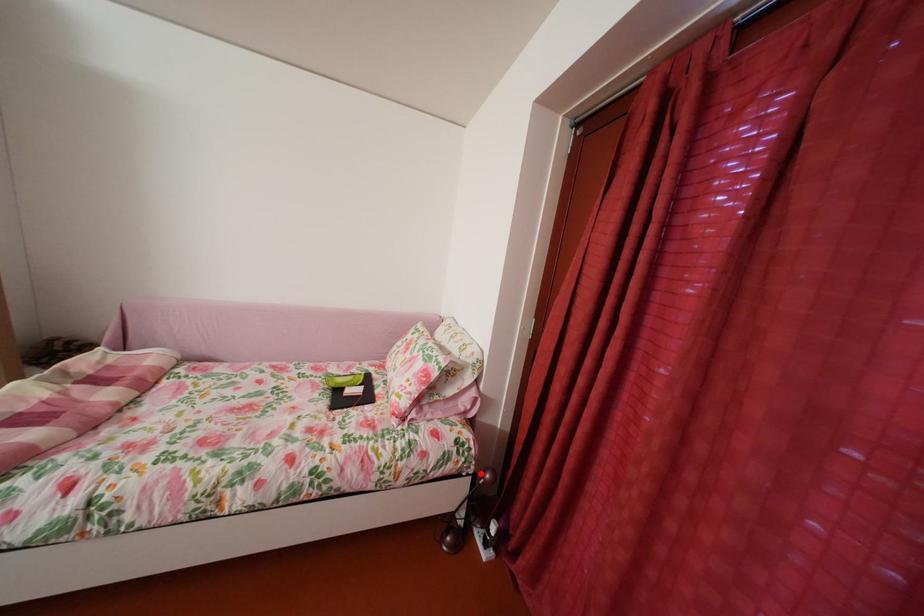
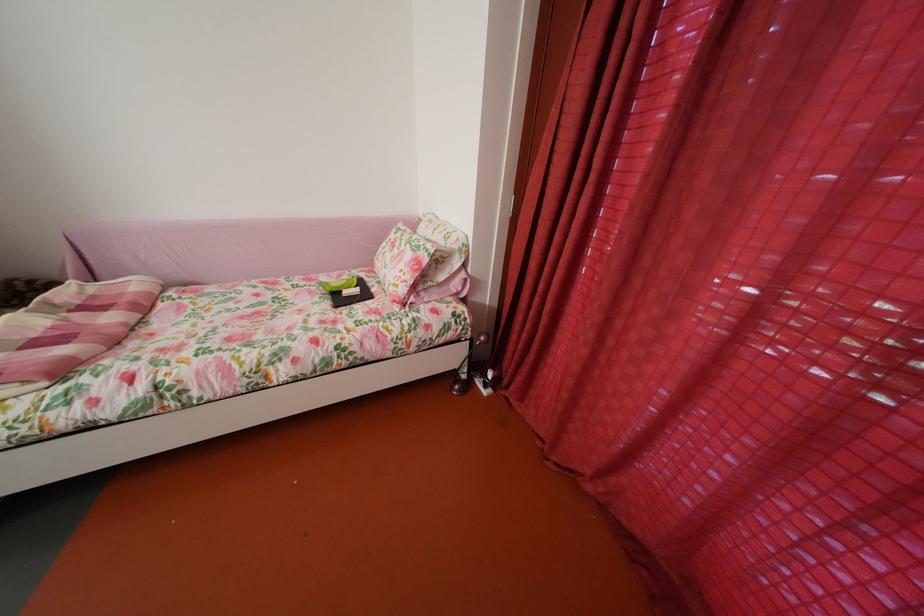
Question: I am providing you with two images of the same scene from different viewpoints. A red point is shown in image1. For the corresponding object point in image2, is it positioned nearer or farther from the camera?

Choices:
 (A) Nearer
 (B) Farther

Answer: (A)